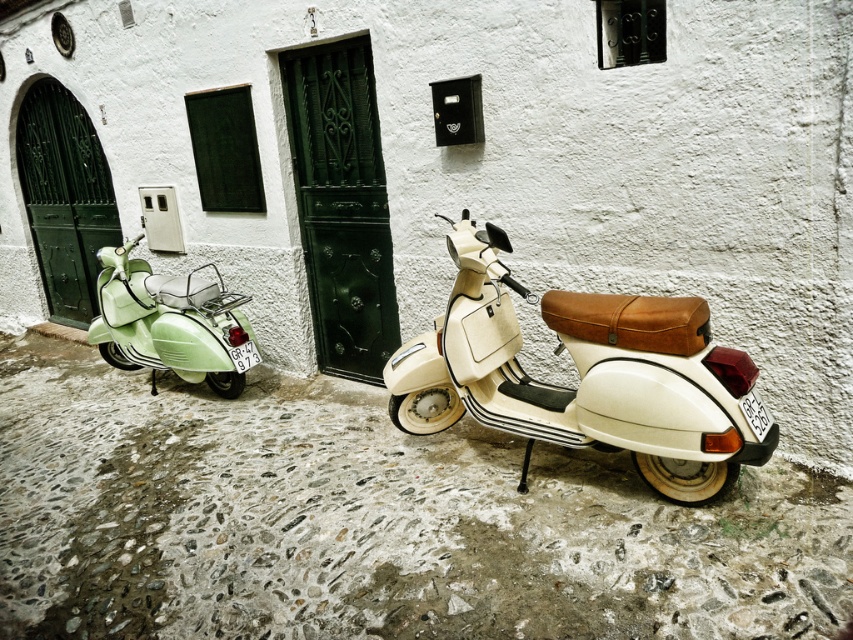
You are a delivery person with a cart that is 2 meters long. You need to move your cart between the matte cream scooter at center and the pastel green matte scooter at left. Is there enough space for your cart to fit through the gap between them?

The distance between the matte cream scooter at center and the pastel green matte scooter at left is 2.64 meters. Since your cart is 2 meters long, there is enough space for it to fit through the gap between them.

You are a delivery person standing at the entrance of the street. You need to park your scooter exactly at the center of the street. The street is 10 meters long. Can you determine if the matte cream scooter at center is already parked at the center of the street?

The matte cream scooter at center is positioned at point (585, 376), which is the center of the image, so yes, it is parked at the center of the street.